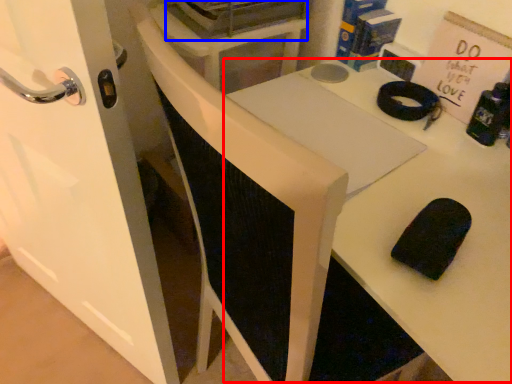
Question: Among these objects, which one is farthest to the camera, table (highlighted by a red box) or appliance (highlighted by a blue box)?

Choices:
 (A) table
 (B) appliance

Answer: (B)